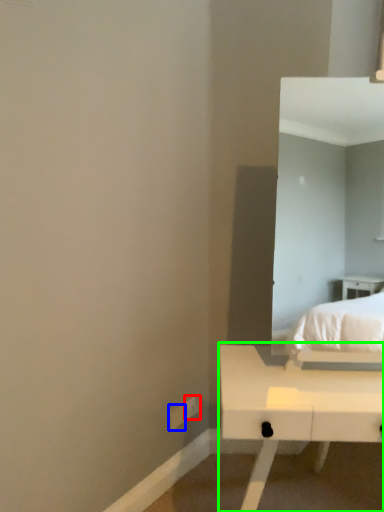
Question: Which is nearer to the electric outlet (highlighted by a red box)? electric outlet (highlighted by a blue box) or table (highlighted by a green box).

Choices:
 (A) electric outlet
 (B) table

Answer: (A)